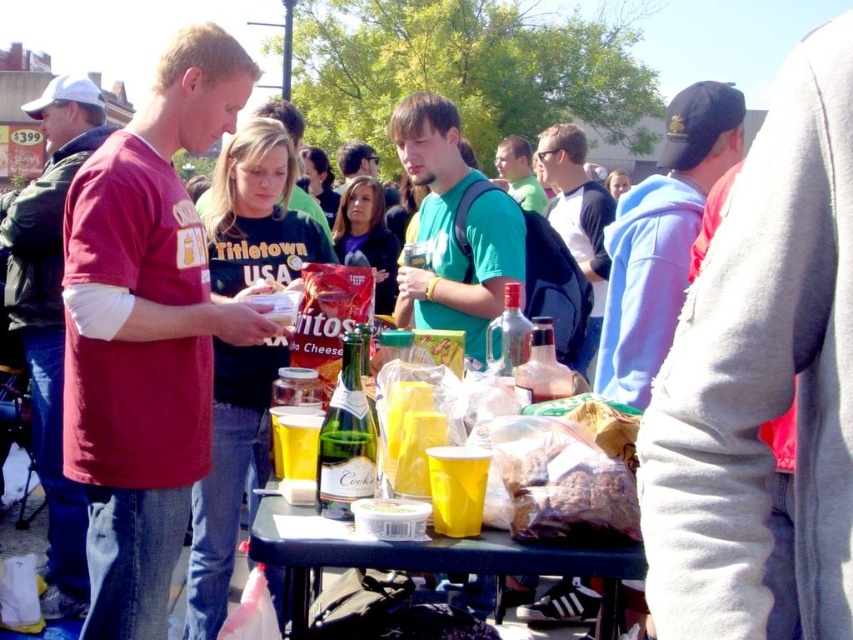
Question: Is maroon cotton shirt at left below translucent plastic bottle at center?

Choices:
 (A) yes
 (B) no

Answer: (B)

Question: In this image, where is clear glass bottle at center located relative to white plastic container at center?

Choices:
 (A) below
 (B) above

Answer: (B)

Question: Based on their relative distances, which object is farther from the white cotton hoodie at upper right?

Choices:
 (A) green matte shirt at center
 (B) gray fleece sweatshirt at upper right
 (C) green t-shirt at center

Answer: (B)

Question: Does matte red t-shirt at center appear over clear glass bottle at center?

Choices:
 (A) no
 (B) yes

Answer: (B)

Question: Which object is the closest to the blue plastic table at center?

Choices:
 (A) white plastic container at center
 (B) green glass bottle at center

Answer: (A)

Question: Among these objects, which one is nearest to the camera?

Choices:
 (A) blue plastic table at center
 (B) white plastic container at center

Answer: (A)